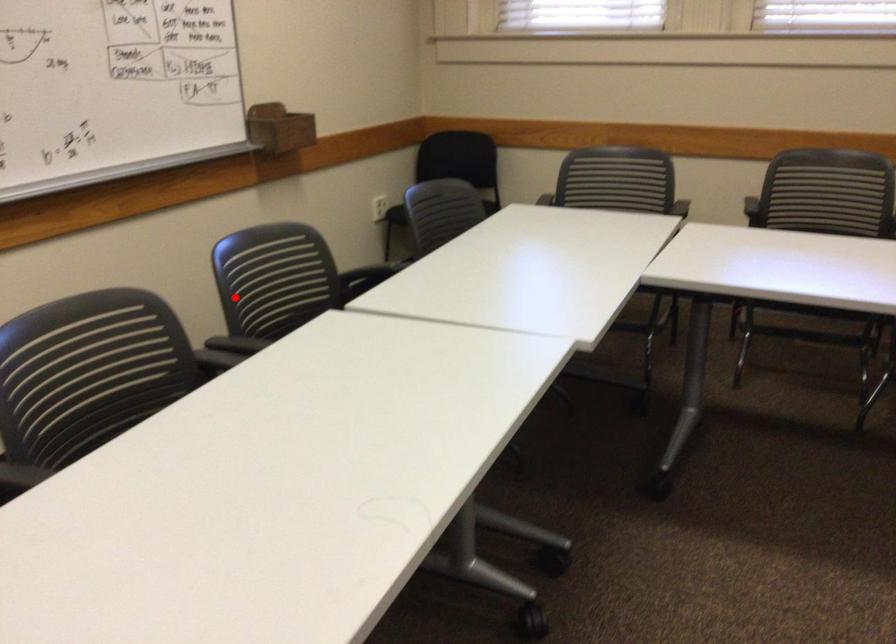
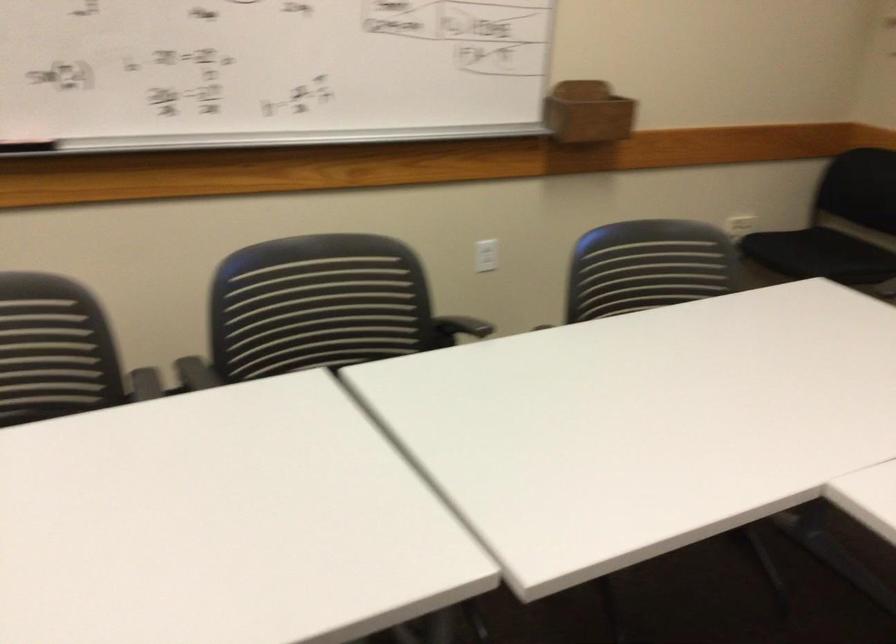
Locate, in the second image, the point that corresponds to the highlighted location in the first image.

(317, 308)